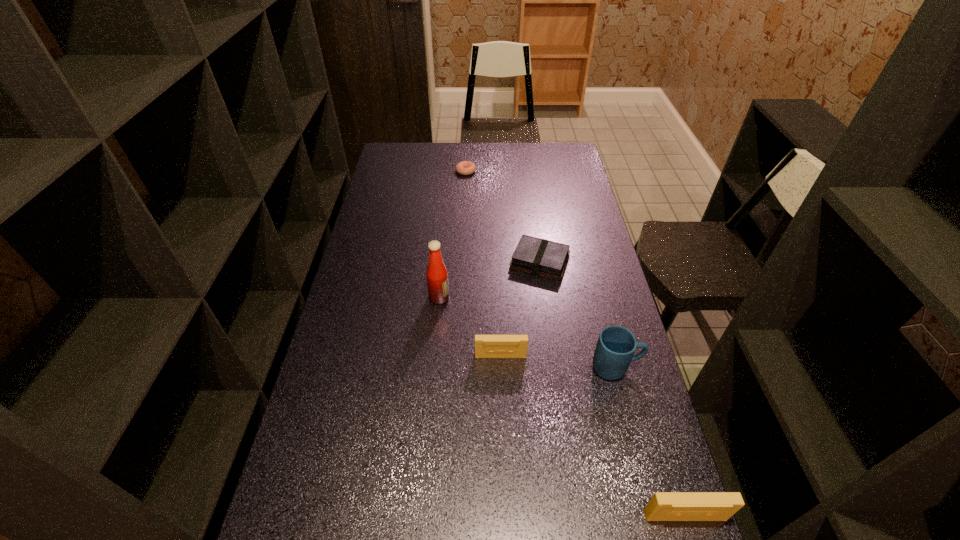
The height and width of the screenshot is (540, 960). I want to click on object present at the near right corner, so click(664, 506).

In the image, there is a desktop. In order to click on vacant area at the far edge in this screenshot , I will do `click(476, 161)`.

Find the location of a particular element. This screenshot has width=960, height=540. free spot at the near edge of the desktop is located at coordinates (583, 514).

In the image, there is a desktop. Where is `blank space at the left edge`? This screenshot has width=960, height=540. blank space at the left edge is located at coordinates (365, 346).

Image resolution: width=960 pixels, height=540 pixels. In order to click on vacant space at the right edge of the desktop in this screenshot , I will do pos(590,370).

Locate an element on the screen. Image resolution: width=960 pixels, height=540 pixels. free space at the far right corner of the desktop is located at coordinates (547, 159).

Where is `vacant space that is in between the condiment and the left videotape`? This screenshot has width=960, height=540. vacant space that is in between the condiment and the left videotape is located at coordinates (469, 327).

Image resolution: width=960 pixels, height=540 pixels. Identify the location of free space between the right videotape and the book. (612, 389).

The image size is (960, 540). Identify the location of free space between the second tallest object and the right videotape. (650, 442).

This screenshot has height=540, width=960. What are the coordinates of `unoccupied area between the farthest object and the right videotape` in the screenshot? It's located at (575, 343).